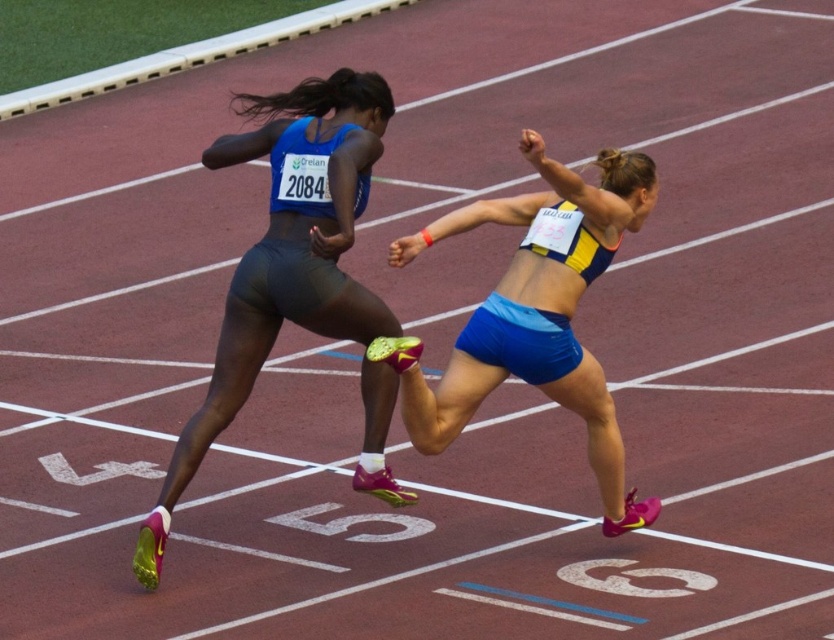
Question: Can you confirm if matte blue shorts at center is smaller than blue fabric shorts at center?

Choices:
 (A) no
 (B) yes

Answer: (A)

Question: Is matte blue shorts at center thinner than blue fabric shorts at center?

Choices:
 (A) no
 (B) yes

Answer: (B)

Question: Is matte blue shorts at center positioned in front of blue fabric shorts at center?

Choices:
 (A) yes
 (B) no

Answer: (B)

Question: Among these points, which one is farthest from the camera?

Choices:
 (A) (520, 360)
 (B) (240, 269)

Answer: (B)

Question: Among these points, which one is nearest to the camera?

Choices:
 (A) (483, 216)
 (B) (335, 109)

Answer: (A)

Question: Which point is farther to the camera?

Choices:
 (A) blue fabric shorts at center
 (B) matte blue shorts at center

Answer: (B)